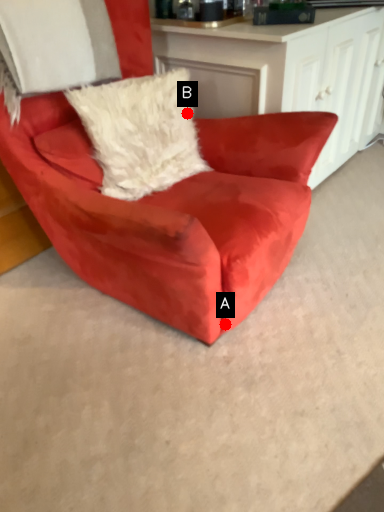
Question: Two points are circled on the image, labeled by A and B beside each circle. Which point appears closest to the camera in this image?

Choices:
 (A) A is closer
 (B) B is closer

Answer: (A)